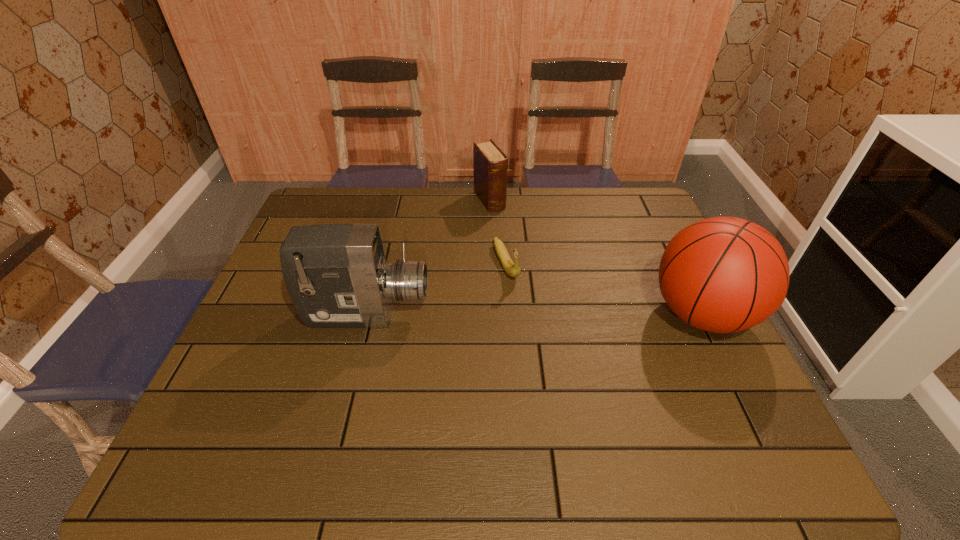
You are a GUI agent. You are given a task and a screenshot of the screen. Output one action in this format:
    pyautogui.click(x=<x>, y=<y>)
    Task: Click on the free point at the far right corner
    Image resolution: width=960 pixels, height=540 pixels.
    Given the screenshot: What is the action you would take?
    (626, 193)

The width and height of the screenshot is (960, 540). I want to click on vacant space at the near right corner of the desktop, so click(x=729, y=395).

Where is `free space between the camcorder and the banana`? The width and height of the screenshot is (960, 540). free space between the camcorder and the banana is located at coordinates pyautogui.click(x=437, y=289).

Image resolution: width=960 pixels, height=540 pixels. Find the location of `vacant space that is in between the leftmost object and the shortest object`. vacant space that is in between the leftmost object and the shortest object is located at coordinates (437, 289).

Identify the location of empty space between the third tallest object and the shortest object. (498, 232).

Where is `free spot between the banana and the farthest object`? The width and height of the screenshot is (960, 540). free spot between the banana and the farthest object is located at coordinates click(x=498, y=232).

I want to click on free point between the rightmost object and the camcorder, so click(534, 314).

Where is `free area in between the camcorder and the diary`? free area in between the camcorder and the diary is located at coordinates (428, 258).

Locate an element on the screen. free space between the basketball and the shortest object is located at coordinates (604, 289).

At what (x,y) coordinates should I click in order to perform the action: click on vacant space that's between the camcorder and the rightmost object. Please return your answer as a coordinate pair (x, y). Image resolution: width=960 pixels, height=540 pixels. Looking at the image, I should click on (534, 314).